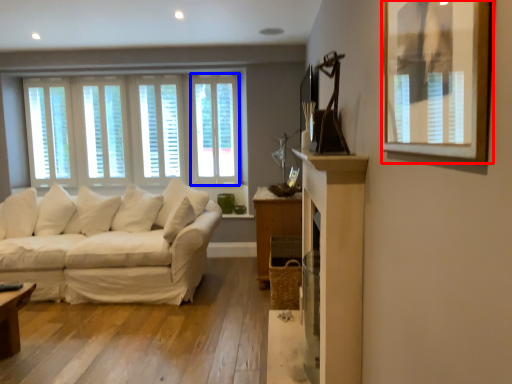
Question: Which object appears closest to the camera in this image, picture frame (highlighted by a red box) or window (highlighted by a blue box)?

Choices:
 (A) picture frame
 (B) window

Answer: (A)